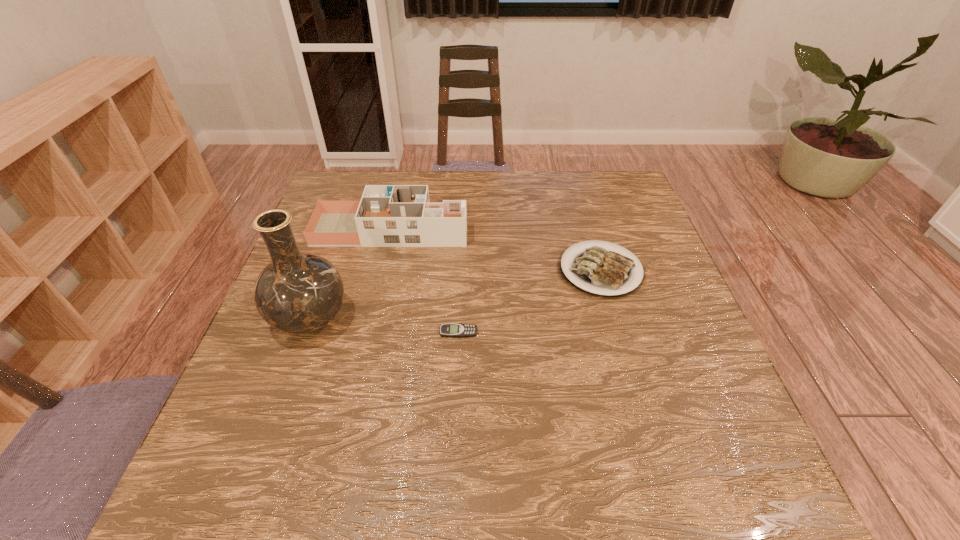
In order to click on vase in this screenshot , I will do `click(297, 293)`.

Where is `dollhouse`? dollhouse is located at coordinates (387, 215).

Where is `plate`? This screenshot has height=540, width=960. plate is located at coordinates pyautogui.click(x=601, y=271).

Find the location of `the third tallest object`. the third tallest object is located at coordinates (601, 271).

The width and height of the screenshot is (960, 540). Find the location of `beeper`. beeper is located at coordinates (452, 330).

The image size is (960, 540). I want to click on vacant space located on the back of the tallest object, so click(x=338, y=243).

Locate an element on the screen. blank space located at the front door of the third shortest object is located at coordinates (489, 229).

I want to click on blank space located on the left of the rightmost object, so click(506, 270).

Image resolution: width=960 pixels, height=540 pixels. I want to click on free space located on the left of the shortest object, so click(x=353, y=332).

In order to click on object that is at the far edge in this screenshot , I will do `click(387, 215)`.